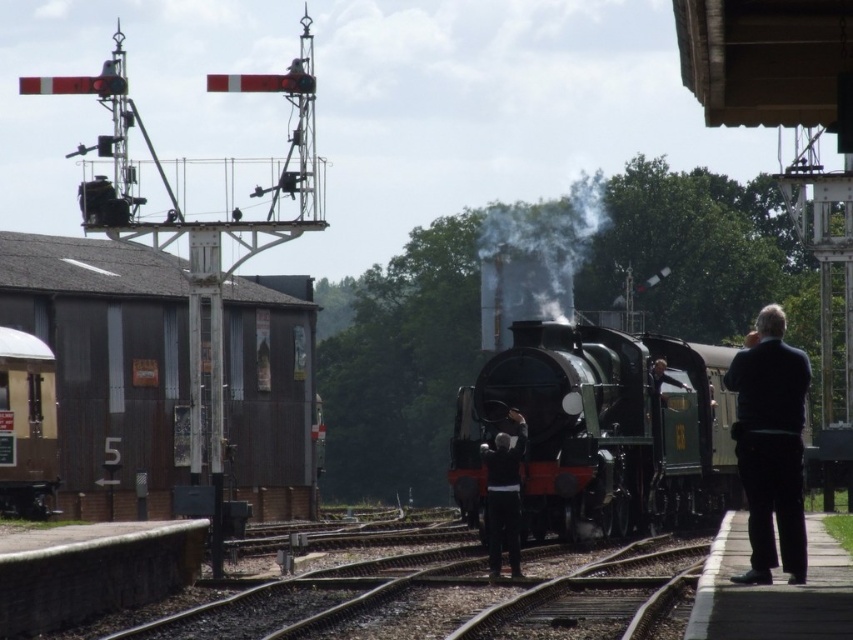
You are standing on the platform at the railway station and want to walk from point (70,368) to point (758,566). Which direction should you move relative to the locomotive?

You should move away from the locomotive because point (758,566) is further from the viewer compared to point (70,368), which means moving towards the locomotive would take you in the opposite direction.

You are standing at the railway station and want to take a photo of the steam locomotive. The camera you are holding is located at point (x=750, y=440). Can you confirm if this position is within a safe distance of 20 meters from the locomotive?

The point (x=750, y=440) is 17.86 meters away from the viewer, so yes, it is within the safe distance of 20 meters.

You are a photographer standing on the platform at the railway station. You want to take a photo of the rusty metal building at left and the black woolen jacket at right. Based on their positions, which object should appear higher in your photo?

The rusty metal building at left should appear higher in the photo because it is positioned above the black woolen jacket at right.